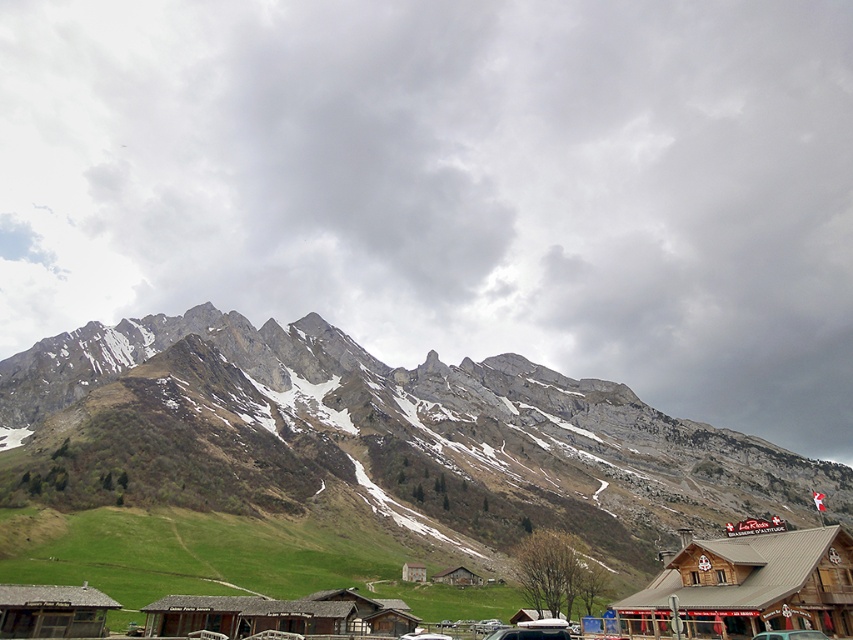
Is rugged stone mountain range at center closer to camera compared to brown wooden hut at lower center?

No, rugged stone mountain range at center is further to the viewer.

Is rugged stone mountain range at center to the right of brown wooden hut at lower center from the viewer's perspective?

Indeed, rugged stone mountain range at center is positioned on the right side of brown wooden hut at lower center.

Is point (172, 486) positioned in front of point (393, 621)?

No.

Find the location of a particular element. The image size is (853, 640). rugged stone mountain range at center is located at coordinates (380, 435).

Is point (36, 609) farther from viewer compared to point (459, 579)?

That is False.

Can you confirm if wooden hut at lower left is positioned above wooden cabin at center?

Yes, wooden hut at lower left is above wooden cabin at center.

Does point (44, 609) lie behind point (474, 573)?

No, it is in front of (474, 573).

Locate an element on the screen. This screenshot has width=853, height=640. wooden hut at lower left is located at coordinates (51, 611).

Does brown wooden hut at lower center come in front of brown wooden hut at center?

No.

How distant is brown wooden hut at lower center from brown wooden hut at center?

97.81 feet

Is point (258, 602) in front of point (515, 618)?

That is True.

Locate an element on the screen. The width and height of the screenshot is (853, 640). brown wooden hut at lower center is located at coordinates (277, 614).